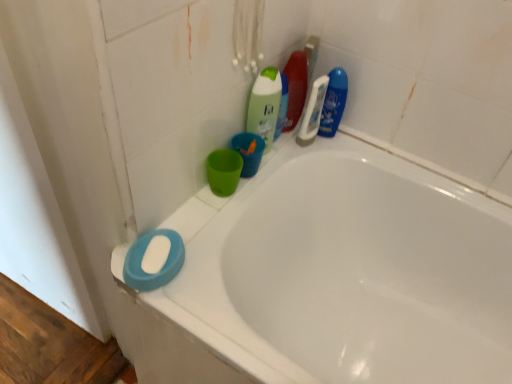
Where is `vacant space that is in between matte plastic cup at upper center and white matte soap at lower left`? vacant space that is in between matte plastic cup at upper center and white matte soap at lower left is located at coordinates (197, 213).